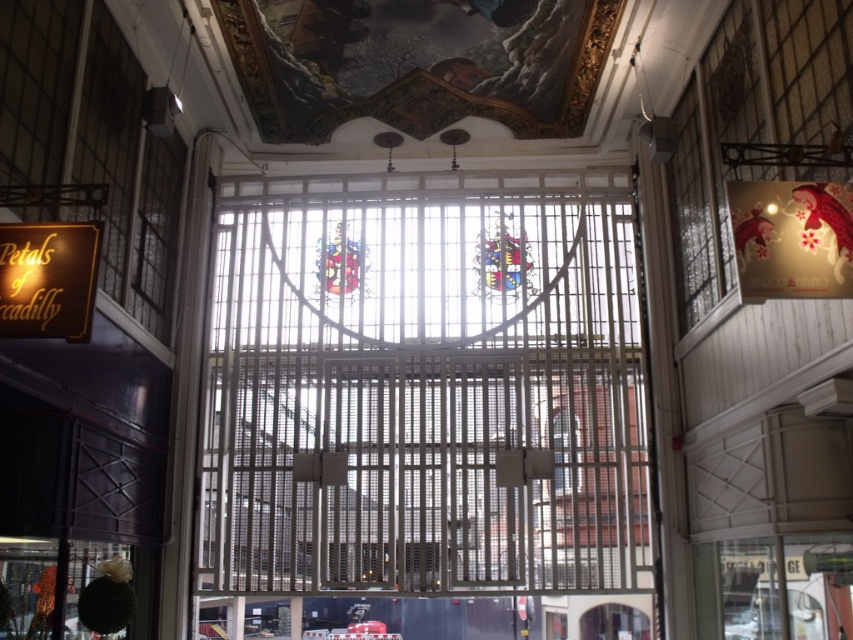
Does metallic grid at center lie in front of gold wooden sign at left?

No, metallic grid at center is further to the viewer.

Does metallic grid at center appear on the left side of gold wooden sign at left?

In fact, metallic grid at center is to the right of gold wooden sign at left.

Does point (445, 445) lie behind point (96, 262)?

Yes, it is.

Where is `metallic grid at center`? This screenshot has height=640, width=853. metallic grid at center is located at coordinates (424, 387).